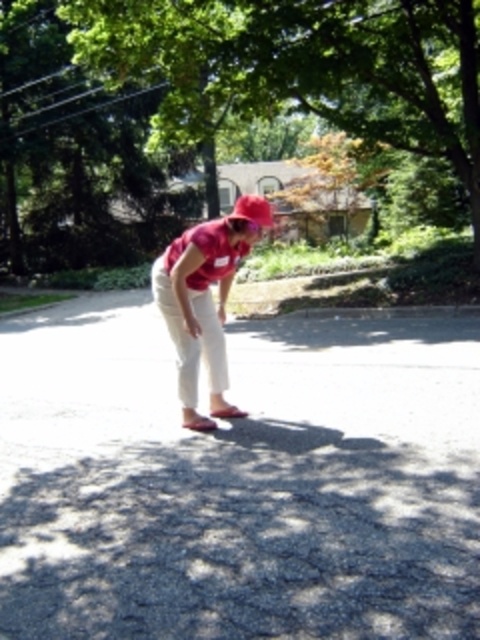
Between green leafy tree at upper center and matte red cap at center, which one is positioned lower?

matte red cap at center is below.

Can you confirm if green leafy tree at upper center is positioned to the right of matte red cap at center?

Incorrect, green leafy tree at upper center is not on the right side of matte red cap at center.

Find the location of a particular element. This screenshot has width=480, height=640. green leafy tree at upper center is located at coordinates (216, 106).

The width and height of the screenshot is (480, 640). I want to click on green leafy tree at upper center, so [x=216, y=106].

Can you confirm if matte red cap at center is positioned above pink fabric hat at center?

No.

Describe the element at coordinates (204, 300) in the screenshot. I see `matte red cap at center` at that location.

Locate an element on the screen. The height and width of the screenshot is (640, 480). matte red cap at center is located at coordinates (204, 300).

Is point (215, 202) behind point (257, 205)?

Yes, it is behind point (257, 205).

Who is shorter, green leafy tree at upper center or pink fabric hat at center?

pink fabric hat at center

You are a GUI agent. You are given a task and a screenshot of the screen. Output one action in this format:
    pyautogui.click(x=<x>, y=<y>)
    Task: Click on the green leafy tree at upper center
    The width and height of the screenshot is (480, 640).
    Given the screenshot: What is the action you would take?
    pyautogui.click(x=216, y=106)